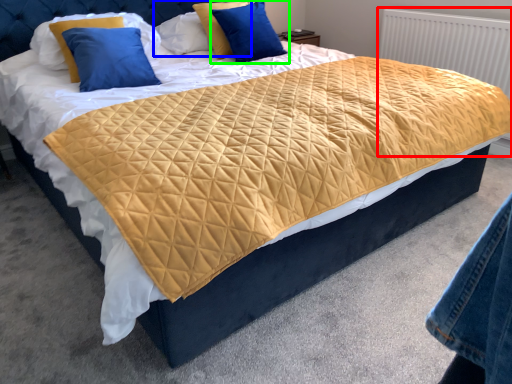
Question: Which object is positioned closest to radiator (highlighted by a red box)? Select from pillow (highlighted by a blue box) and pillow (highlighted by a green box).

Choices:
 (A) pillow
 (B) pillow

Answer: (B)